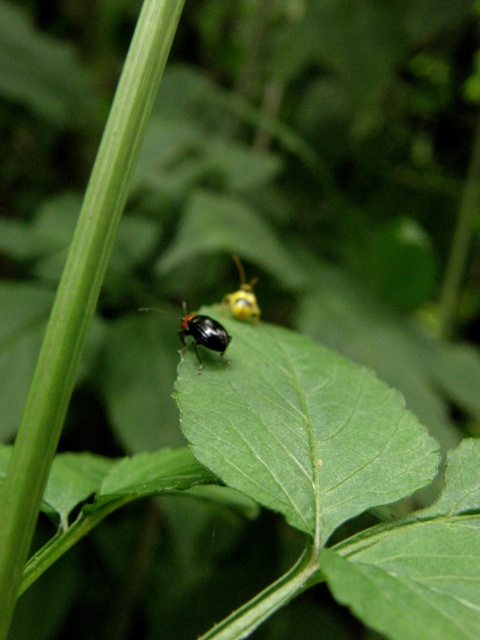
You are an entomologist observing the two beetles on the leaf. Which beetle is taller between the black glossy beetle at center and the yellow matte leaf beetle at center?

The black glossy beetle at center is taller than the yellow matte leaf beetle at center.

You are an entomologist observing the leafy plant. You need to locate the black glossy beetle at center. What are its coordinates on the leaf?

The black glossy beetle at center is located at coordinates (x=202, y=333).